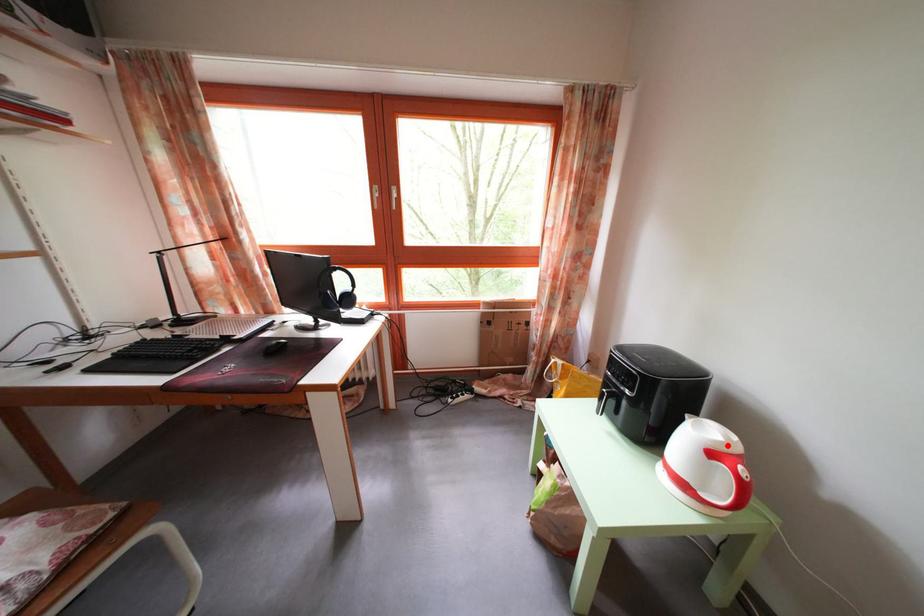
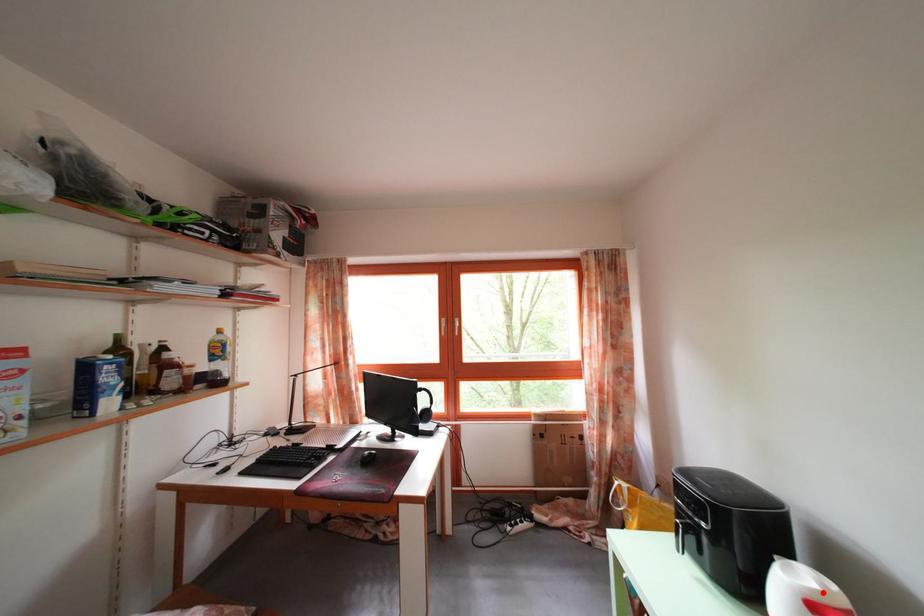
I am providing you with two images of the same scene from different viewpoints. A red point is marked on the first image and another point is marked on the second image. Does the point marked in image1 correspond to the same location as the one in image2?

Yes